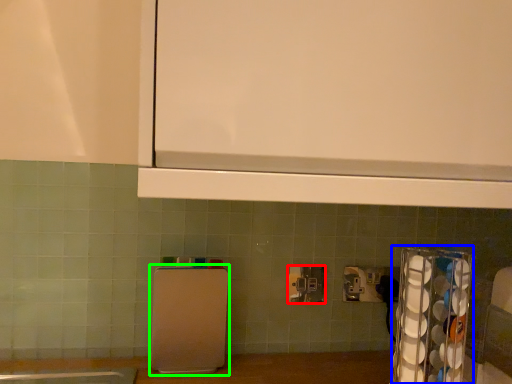
Question: Which is nearer to the power plugs and sockets (highlighted by a red box)? appliance (highlighted by a blue box) or appliance (highlighted by a green box).

Choices:
 (A) appliance
 (B) appliance

Answer: (B)